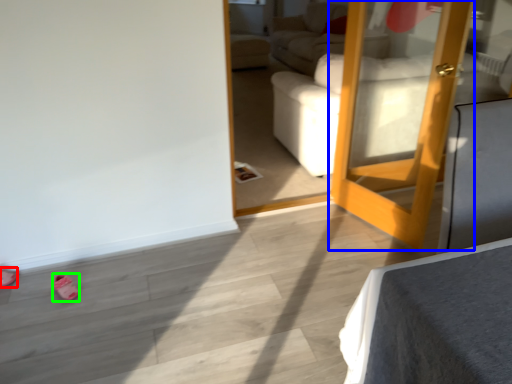
Question: Based on their relative distances, which object is farther from shoe (highlighted by a red box)? Choose from door (highlighted by a blue box) and shoe (highlighted by a green box).

Choices:
 (A) door
 (B) shoe

Answer: (A)